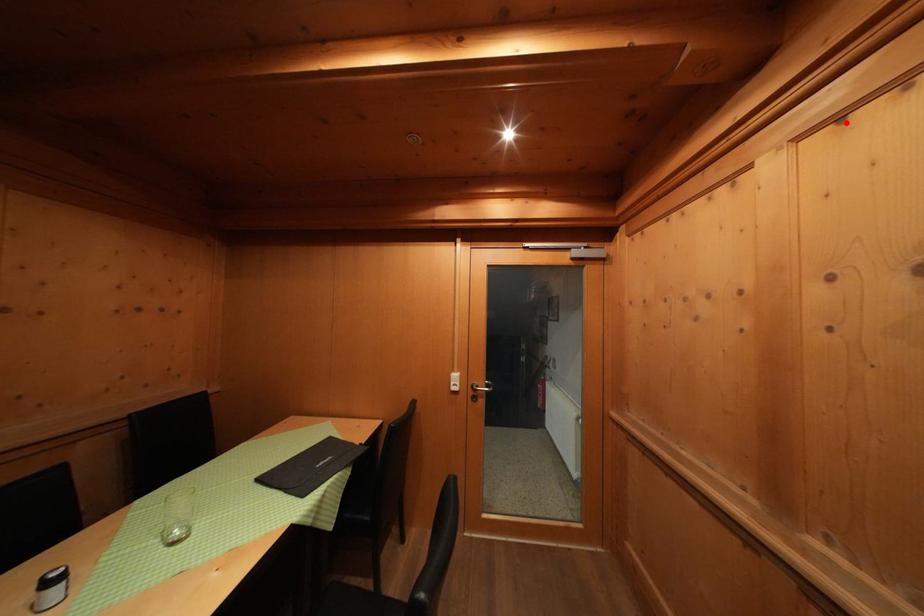
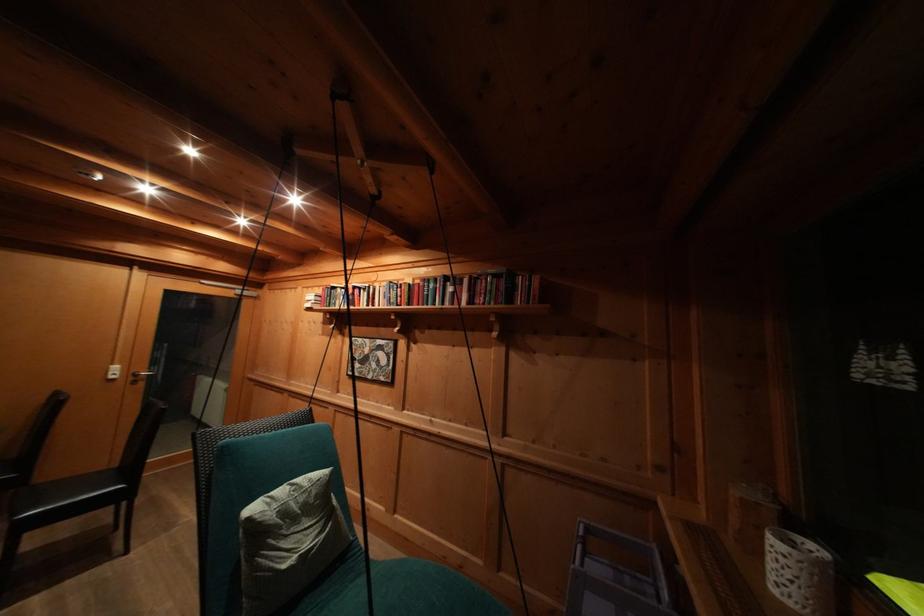
Locate, in the second image, the point that corresponds to the highlighted location in the first image.

(313, 293)